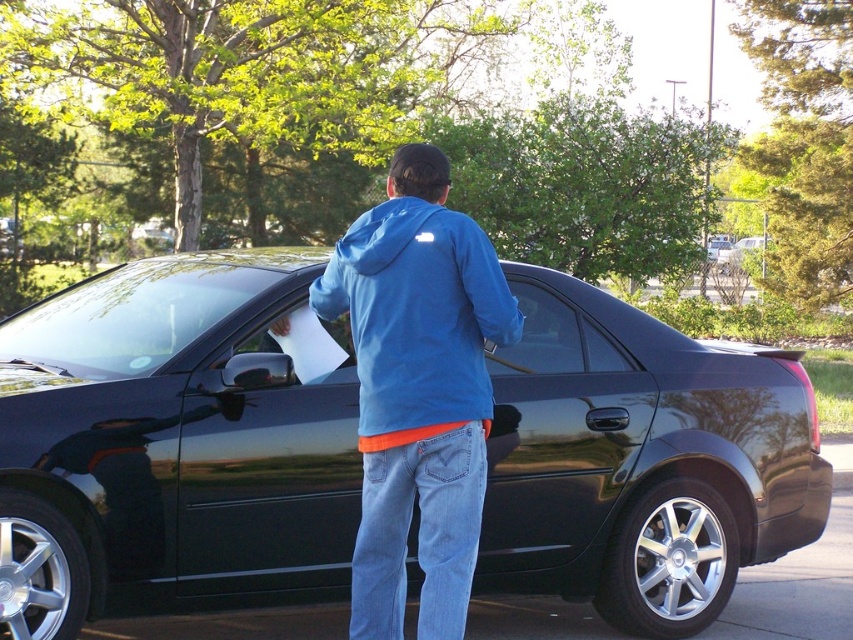
You are a tailor measuring two blue jackets for alterations. The first is a blue cotton hoodie at center and the second is a blue fleece sweatshirt at center. Which one is closer to the center of the image?

Both the blue cotton hoodie at center and the blue fleece sweatshirt at center are positioned at the center of the image. The blue cotton hoodie at center is 3.35 inches away from the blue fleece sweatshirt at center, so they are equally centered but separated by that distance.

You are a delivery person carrying a package that is 1.5 meters wide. You need to place it between the glossy black car at center and the blue cotton hoodie at center. Can the package fit in the space between them?

The glossy black car at center is wider than the blue cotton hoodie at center. Therefore, the space between them may not be wide enough to accommodate a 1.5 meter wide package. You should check the exact dimensions of the space before placing the package.